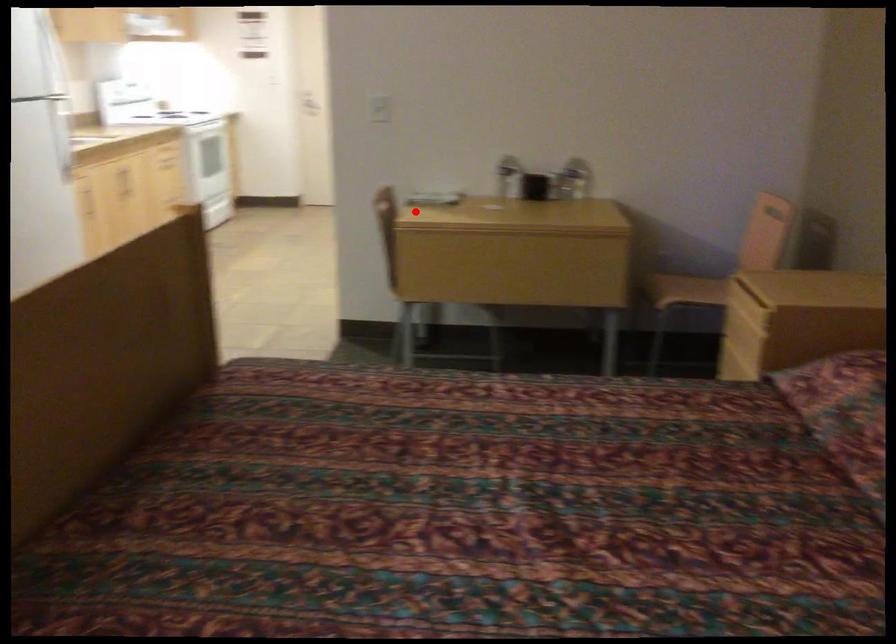
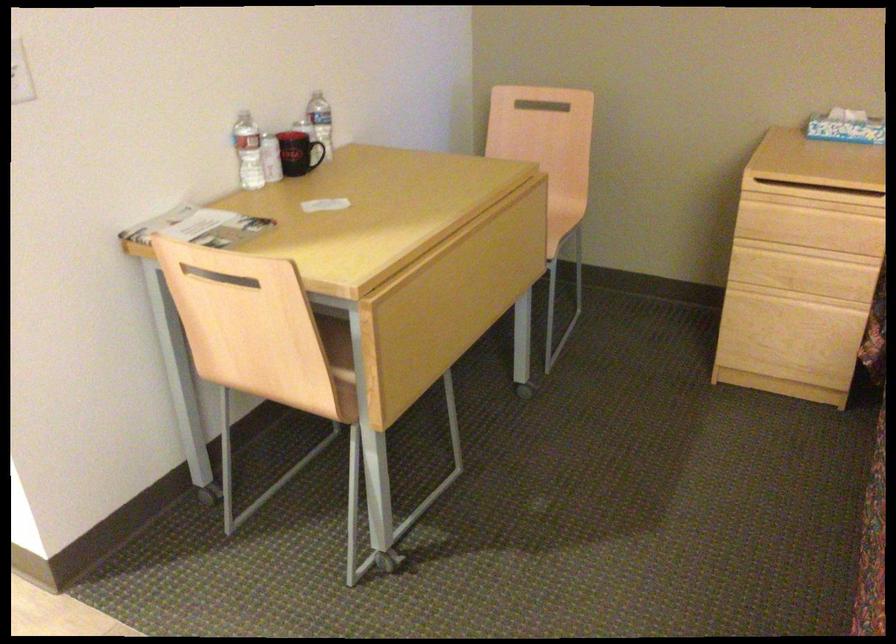
Question: I am providing you with two images of the same scene from different viewpoints. A red point is shown in image1. For the corresponding object point in image2, is it positioned nearer or farther from the camera?

Choices:
 (A) Nearer
 (B) Farther

Answer: (A)